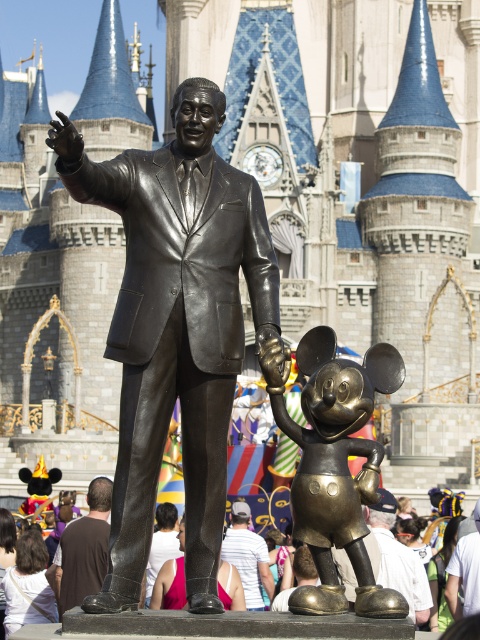
Who is positioned more to the left, bronze statue at center or bronze mickey mouse statue at center?

Positioned to the left is bronze statue at center.

Who is shorter, bronze statue at center or bronze mickey mouse statue at center?

bronze mickey mouse statue at center is shorter.

This screenshot has width=480, height=640. What do you see at coordinates (176, 324) in the screenshot?
I see `bronze statue at center` at bounding box center [176, 324].

Identify the location of bronze statue at center. The width and height of the screenshot is (480, 640). (176, 324).

Which of these two, bronze statue at center or white cotton shirt at center, stands shorter?

white cotton shirt at center

Can you confirm if bronze statue at center is shorter than white cotton shirt at center?

In fact, bronze statue at center may be taller than white cotton shirt at center.

Locate an element on the screen. Image resolution: width=480 pixels, height=640 pixels. bronze statue at center is located at coordinates (176, 324).

I want to click on bronze statue at center, so click(176, 324).

Who is shorter, bronze mickey mouse statue at center or white cotton shirt at center?

white cotton shirt at center

Which is below, bronze mickey mouse statue at center or white cotton shirt at center?

Positioned lower is white cotton shirt at center.

Is point (334, 428) more distant than point (245, 584)?

That is False.

In order to click on bronze mickey mouse statue at center in this screenshot , I will do pos(334,461).